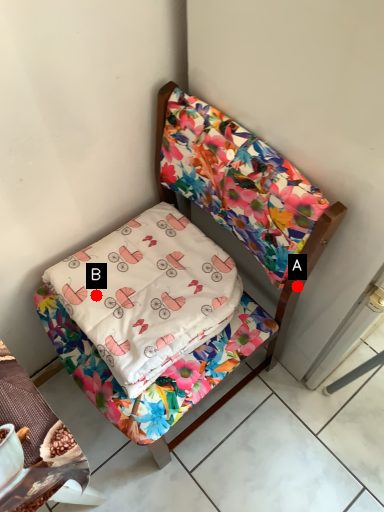
Question: Two points are circled on the image, labeled by A and B beside each circle. Which point is closer to the camera taking this photo?

Choices:
 (A) A is closer
 (B) B is closer

Answer: (A)